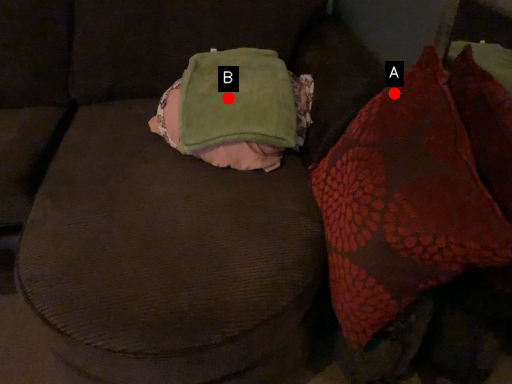
Question: Two points are circled on the image, labeled by A and B beside each circle. Which point is farther from the camera taking this photo?

Choices:
 (A) A is further
 (B) B is further

Answer: (B)